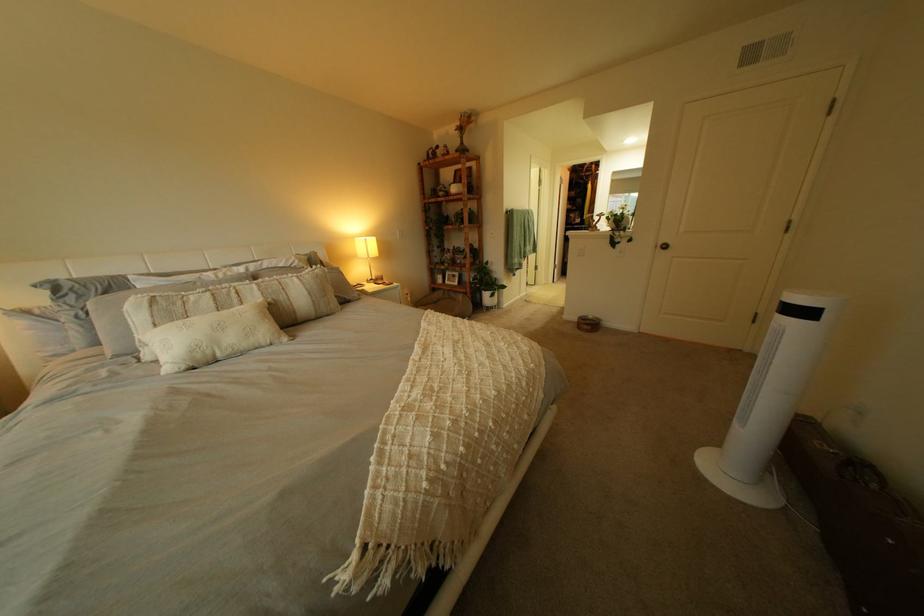
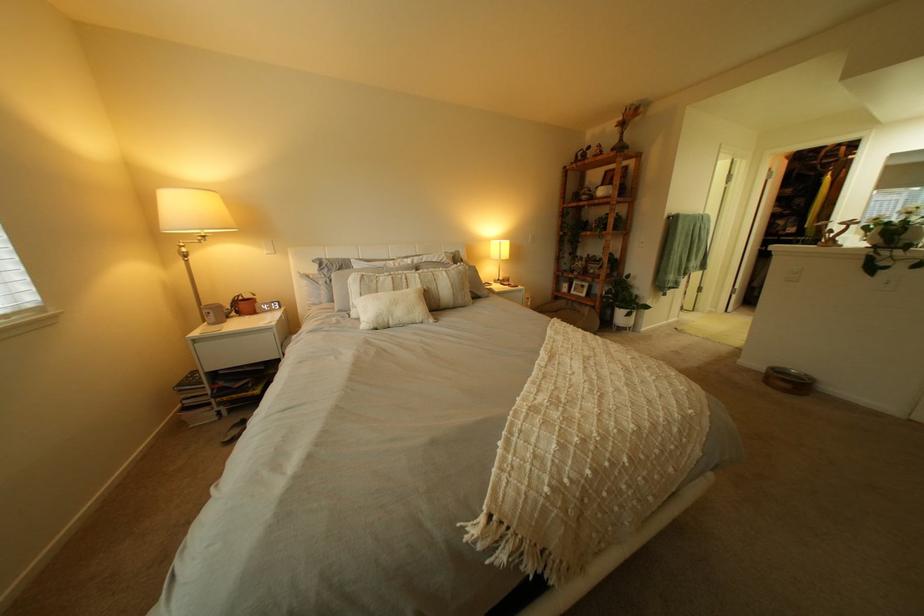
The point at (591, 320) is marked in the first image. Where is the corresponding point in the second image?

(779, 369)